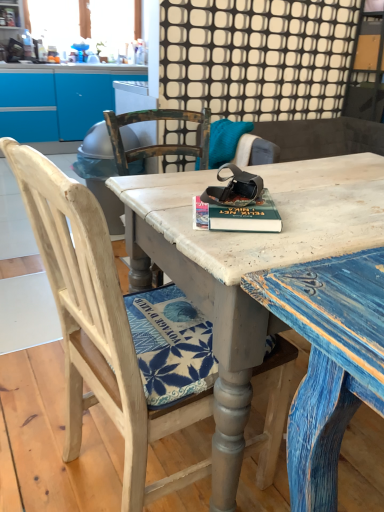
At what (x,y) coordinates should I click in order to perform the action: click on free location in front of hardcover book at center. Please return your answer as a coordinate pair (x, y). The height and width of the screenshot is (512, 384). Looking at the image, I should click on point(246,245).